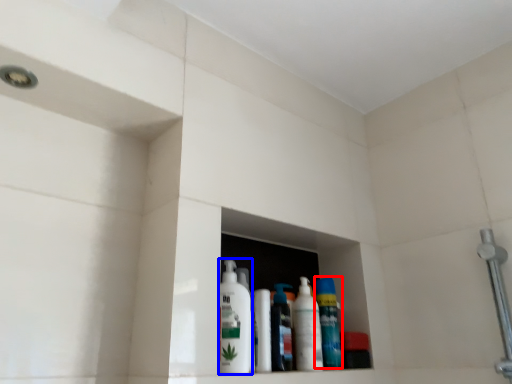
Question: Which point is further to the camera, cleaning product (highlighted by a red box) or cleaning product (highlighted by a blue box)?

Choices:
 (A) cleaning product
 (B) cleaning product

Answer: (A)